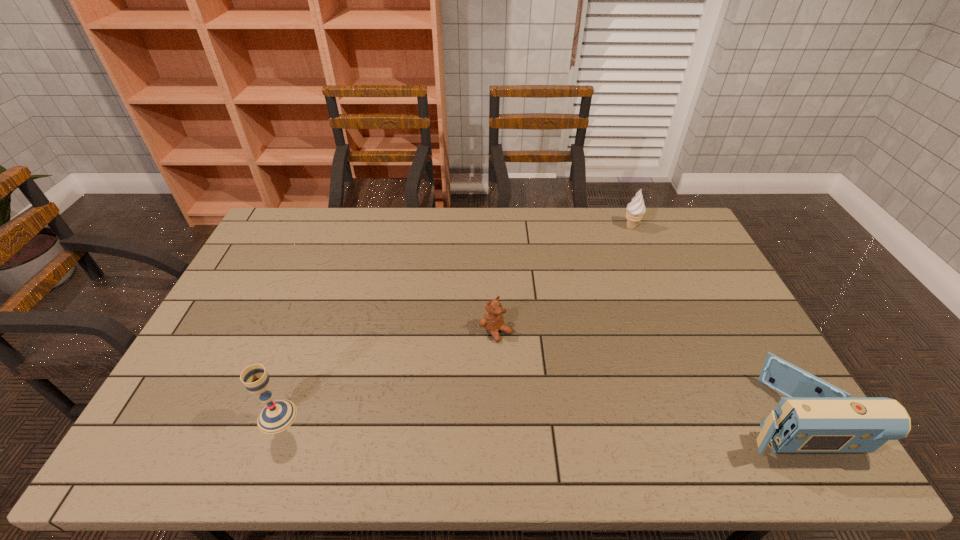
Image resolution: width=960 pixels, height=540 pixels. I want to click on chalice, so click(276, 416).

This screenshot has width=960, height=540. Identify the location of camcorder. (816, 417).

This screenshot has height=540, width=960. Identify the location of the shortest object. (493, 321).

Locate an element on the screen. the third nearest object is located at coordinates (493, 321).

At what (x,y) coordinates should I click in order to perform the action: click on icecream. Please return your answer as a coordinate pair (x, y). Looking at the image, I should click on (635, 209).

What are the coordinates of `the farthest object` in the screenshot? It's located at (635, 209).

The height and width of the screenshot is (540, 960). I want to click on vacant area located 0.180m on the left of the chalice, so click(x=186, y=416).

Image resolution: width=960 pixels, height=540 pixels. In order to click on blank space located on the face of the teddy bear in this screenshot , I will do `click(544, 375)`.

Identify the location of blank space located 0.200m on the face of the teddy bear. (558, 387).

At what (x,y) coordinates should I click in order to perform the action: click on vacant space located on the face of the teddy bear. Please return your answer as a coordinate pair (x, y). The image size is (960, 540). Looking at the image, I should click on (541, 372).